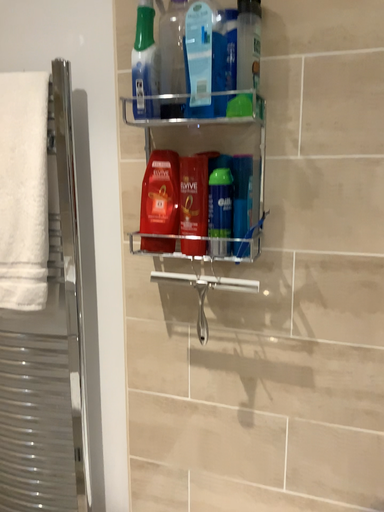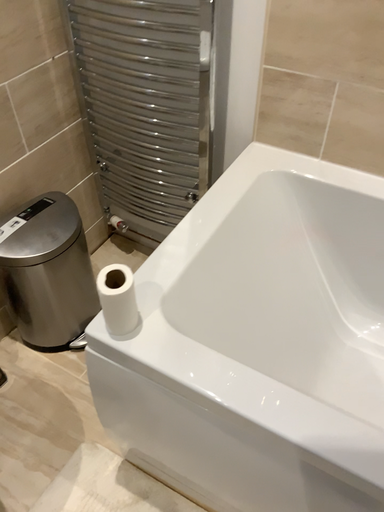
Question: How did the camera likely rotate when shooting the video?

Choices:
 (A) rotated right
 (B) rotated left

Answer: (B)